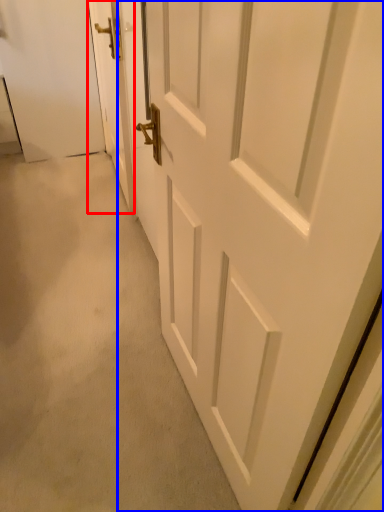
Question: Among these objects, which one is nearest to the camera, door (highlighted by a red box) or door (highlighted by a blue box)?

Choices:
 (A) door
 (B) door

Answer: (B)